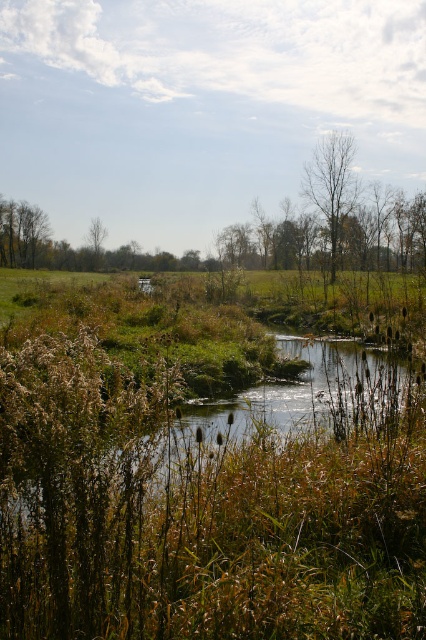
In the scene shown: Who is more distant from viewer, [325,147] or [40,234]?

Point [40,234]

Measure the distance between point (354, 144) and camera.

Point (354, 144) is 55.16 meters from camera.

Is point (336, 145) less distant than point (14, 243)?

Yes, point (336, 145) is in front of point (14, 243).

The height and width of the screenshot is (640, 426). Identify the location of bare wood tree at upper center. (331, 186).